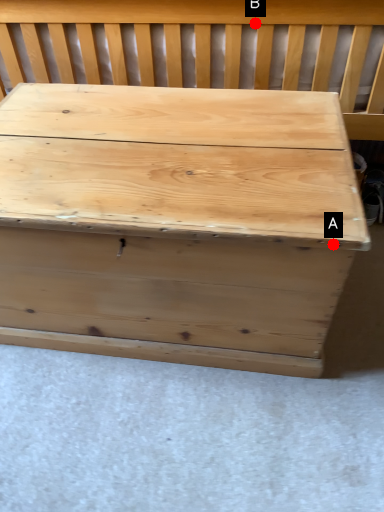
Question: Two points are circled on the image, labeled by A and B beside each circle. Which point is closer to the camera taking this photo?

Choices:
 (A) A is closer
 (B) B is closer

Answer: (A)